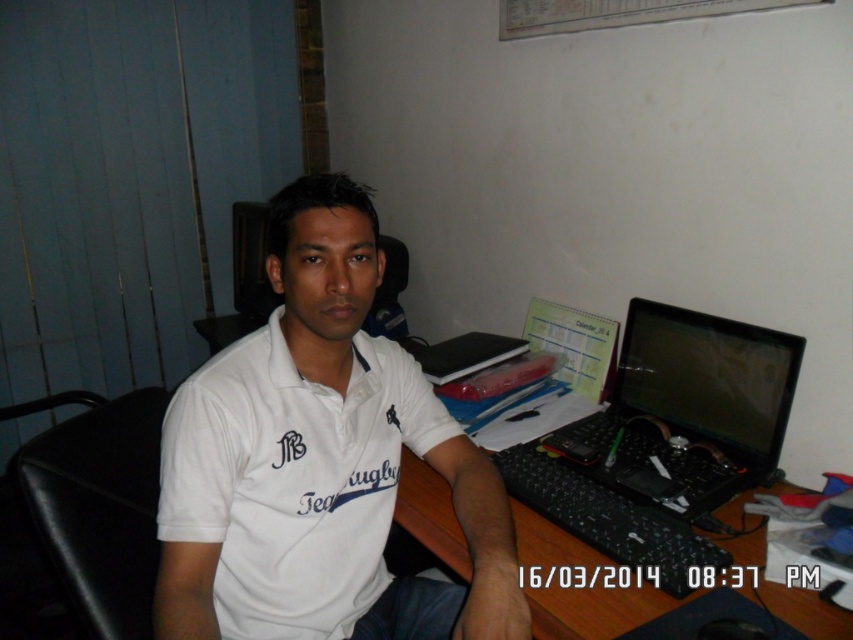
You are standing in the office and want to sit down. Where is the black leather chair at left located?

The black leather chair at left is located at point (x=99, y=509).

You are an office worker who needs to sit down to work. You see the black leather chair at left and the black plastic laptop at right. Which object should you approach first to start working?

You should approach the black leather chair at left first because it is located below the black plastic laptop at right, meaning it is closer to you and easier to reach before the laptop.